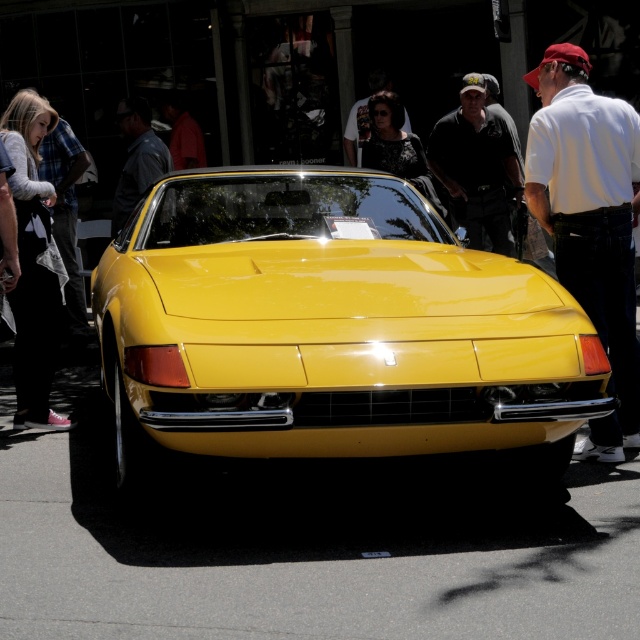
Question: Is glossy yellow car at center bigger than dark green shirt at center?

Choices:
 (A) no
 (B) yes

Answer: (B)

Question: Which of the following is the closest to the observer?

Choices:
 (A) dark green shirt at center
 (B) glossy yellow car at center

Answer: (B)

Question: Can you confirm if glossy yellow car at center is positioned below dark green shirt at center?

Choices:
 (A) yes
 (B) no

Answer: (A)

Question: Among these objects, which one is nearest to the camera?

Choices:
 (A) white cotton shirt at center
 (B) glossy yellow car at center
 (C) dark green shirt at center
 (D) plaid flannel shirt at left

Answer: (B)

Question: Which is farther from the dark green shirt at center?

Choices:
 (A) glossy yellow car at center
 (B) white cotton shirt at center
 (C) plaid flannel shirt at left

Answer: (C)

Question: Can you confirm if glossy yellow car at center is thinner than plaid flannel shirt at left?

Choices:
 (A) no
 (B) yes

Answer: (A)